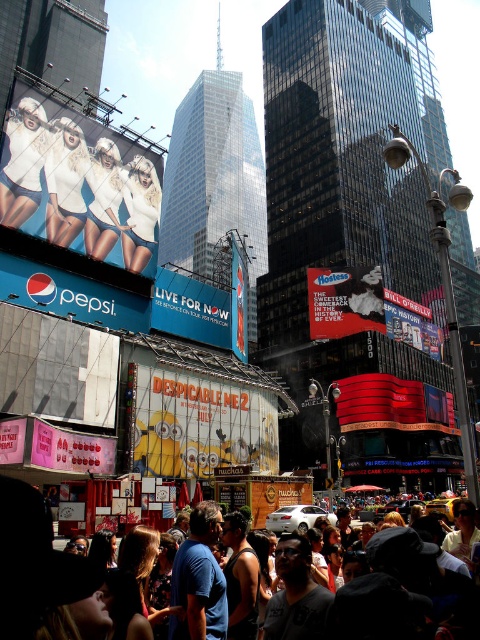
Question: Does blue fabric sign at center appear on the left side of matte pink poster at center?

Choices:
 (A) no
 (B) yes

Answer: (A)

Question: Does matte red hostess sign at center appear on the right side of yellow cartoon character at center?

Choices:
 (A) no
 (B) yes

Answer: (B)

Question: In this image, where is blue glossy pepsi sign at lower left located relative to matte red hostess sign at center?

Choices:
 (A) right
 (B) left

Answer: (B)

Question: Which point is closer to the camera taking this photo?

Choices:
 (A) (356, 412)
 (B) (2, 461)
 (C) (156, 211)

Answer: (B)

Question: Based on their relative distances, which object is farther from the white matte clothing at center?

Choices:
 (A) yellow cartoon characters at center
 (B) dark gray clothing at lower center
 (C) matte red hostess sign at center

Answer: (C)

Question: Among these objects, which one is nearest to the camera?

Choices:
 (A) matte red hostess sign at center
 (B) blue cotton shirt at center

Answer: (B)